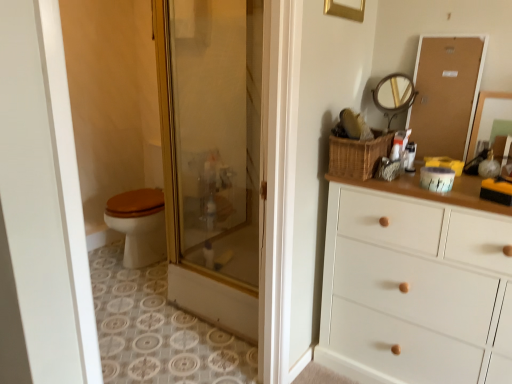
Question: Is corkboard at upper right to the left of gold-toned metal mirror at upper right, which ranks as the first mirror in left-to-right order, from the viewer's perspective?

Choices:
 (A) no
 (B) yes

Answer: (A)

Question: Is corkboard at upper right completely or partially outside of gold-toned metal mirror at upper right, which ranks as the first mirror in left-to-right order?

Choices:
 (A) yes
 (B) no

Answer: (A)

Question: Is corkboard at upper right turned away from gold-toned metal mirror at upper right, which ranks as the first mirror in left-to-right order?

Choices:
 (A) yes
 (B) no

Answer: (B)

Question: Is corkboard at upper right positioned behind gold-toned metal mirror at upper right, which ranks as the 2th mirror in right-to-left order?

Choices:
 (A) yes
 (B) no

Answer: (B)

Question: From the image's perspective, does corkboard at upper right appear lower than gold-toned metal mirror at upper right, which ranks as the first mirror in left-to-right order?

Choices:
 (A) no
 (B) yes

Answer: (A)

Question: Considering the relative sizes of corkboard at upper right and gold-toned metal mirror at upper right, which ranks as the 2th mirror in right-to-left order, in the image provided, is corkboard at upper right wider than gold-toned metal mirror at upper right, which ranks as the 2th mirror in right-to-left order,?

Choices:
 (A) yes
 (B) no

Answer: (B)

Question: Is woven brown basket at upper right placed right next to gold-toned metal mirror at upper right, which ranks as the first mirror in left-to-right order?

Choices:
 (A) yes
 (B) no

Answer: (B)

Question: Is gold-toned metal mirror at upper right, which ranks as the first mirror in left-to-right order, surrounded by woven brown basket at upper right?

Choices:
 (A) no
 (B) yes

Answer: (A)

Question: From the image's perspective, would you say woven brown basket at upper right is shown under gold-toned metal mirror at upper right, which ranks as the 2th mirror in right-to-left order?

Choices:
 (A) no
 (B) yes

Answer: (B)

Question: From the image's perspective, does woven brown basket at upper right appear higher than gold-toned metal mirror at upper right, which ranks as the first mirror in left-to-right order?

Choices:
 (A) no
 (B) yes

Answer: (A)

Question: From a real-world perspective, is woven brown basket at upper right on top of gold-toned metal mirror at upper right, which ranks as the 2th mirror in right-to-left order?

Choices:
 (A) yes
 (B) no

Answer: (B)

Question: Is woven brown basket at upper right not within gold-toned metal mirror at upper right, which ranks as the first mirror in left-to-right order?

Choices:
 (A) no
 (B) yes

Answer: (B)

Question: Can you see corkboard at upper right touching woven brown basket at upper right?

Choices:
 (A) no
 (B) yes

Answer: (A)